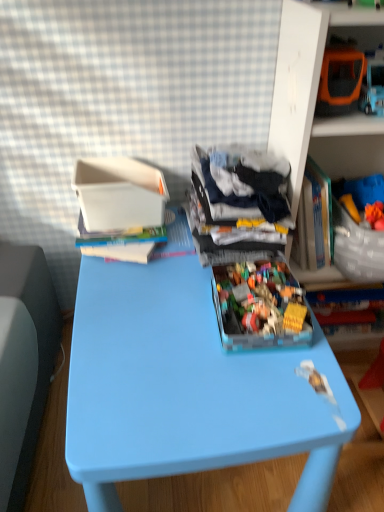
Question: Is blue plastic table at center positioned behind white plastic container at upper left?

Choices:
 (A) no
 (B) yes

Answer: (A)

Question: From a real-world perspective, is blue plastic table at center physically below white plastic container at upper left?

Choices:
 (A) no
 (B) yes

Answer: (B)

Question: Would you consider blue plastic table at center to be distant from white plastic container at upper left?

Choices:
 (A) yes
 (B) no

Answer: (B)

Question: Is blue plastic table at center smaller than white plastic container at upper left?

Choices:
 (A) yes
 (B) no

Answer: (B)

Question: Is blue plastic table at center aimed at white plastic container at upper left?

Choices:
 (A) no
 (B) yes

Answer: (A)

Question: Is the surface of blue plastic table at center in direct contact with white plastic container at upper left?

Choices:
 (A) yes
 (B) no

Answer: (B)

Question: From the image's perspective, would you say translucent plastic container at center is shown under dark blue fabric at center?

Choices:
 (A) yes
 (B) no

Answer: (A)

Question: Is dark blue fabric at center at the back of translucent plastic container at center?

Choices:
 (A) no
 (B) yes

Answer: (B)

Question: From a real-world perspective, is translucent plastic container at center below dark blue fabric at center?

Choices:
 (A) yes
 (B) no

Answer: (A)

Question: Does translucent plastic container at center have a larger size compared to dark blue fabric at center?

Choices:
 (A) yes
 (B) no

Answer: (B)

Question: Does translucent plastic container at center contain dark blue fabric at center?

Choices:
 (A) yes
 (B) no

Answer: (B)

Question: Is translucent plastic container at center next to dark blue fabric at center and touching it?

Choices:
 (A) yes
 (B) no

Answer: (B)

Question: Is dark blue fabric at center outside of orange plastic toy car at upper right, the 2th shelf from the right?

Choices:
 (A) no
 (B) yes

Answer: (B)